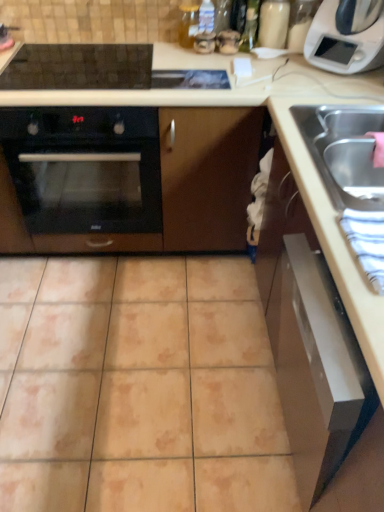
Question: From a real-world perspective, relative to beige ceramic tile at center, is black glass oven at left vertically above or below?

Choices:
 (A) above
 (B) below

Answer: (A)

Question: Is black glass oven at left inside or outside of beige ceramic tile at center?

Choices:
 (A) outside
 (B) inside

Answer: (A)

Question: Estimate the real-world distances between objects in this image. Which object is farther from the white plastic microwave at upper right?

Choices:
 (A) black glass oven at left
 (B) stainless steel sink at right
 (C) satin silver drawer at lower right
 (D) beige ceramic tile at center

Answer: (D)

Question: Estimate the real-world distances between objects in this image. Which object is closer to the stainless steel sink at right?

Choices:
 (A) black glass oven at left
 (B) white plastic microwave at upper right
 (C) satin silver drawer at lower right
 (D) beige ceramic tile at center

Answer: (C)